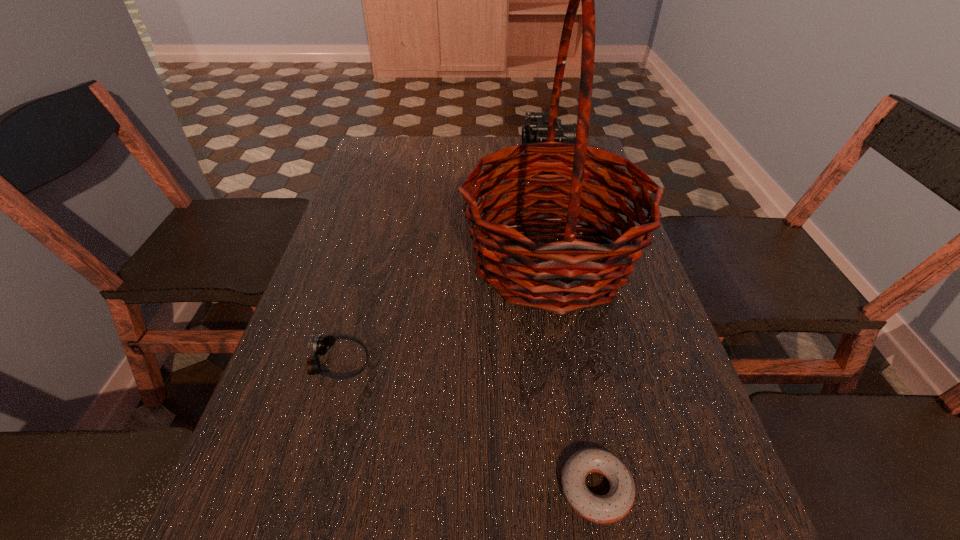
At what (x,y) coordinates should I click in order to perform the action: click on empty space that is in between the tallest object and the leftmost object. Please return your answer as a coordinate pair (x, y). This screenshot has height=540, width=960. Looking at the image, I should click on (444, 312).

Find the location of a particular element. The height and width of the screenshot is (540, 960). free spot between the basket and the nearest object is located at coordinates (573, 374).

Locate an element on the screen. The image size is (960, 540). blank region between the goggles and the basket is located at coordinates (444, 312).

Image resolution: width=960 pixels, height=540 pixels. Identify the location of vacant space that's between the basket and the leftmost object. (444, 312).

Find the location of a particular element. This screenshot has width=960, height=540. the third closest object relative to the second tallest object is located at coordinates (617, 503).

The width and height of the screenshot is (960, 540). Identify the location of object that ranks as the second closest to the binoculars. (321, 345).

Find the location of a particular element. This screenshot has height=540, width=960. free point that satisfies the following two spatial constraints: 1. on the back side of the doughnut; 2. on the handle side of the basket is located at coordinates (553, 260).

Where is `free spot that satisfies the following two spatial constraints: 1. through the lenses of the goggles; 2. on the right side of the doughnut`? free spot that satisfies the following two spatial constraints: 1. through the lenses of the goggles; 2. on the right side of the doughnut is located at coordinates (303, 489).

At what (x,y) coordinates should I click in order to perform the action: click on free space that satisfies the following two spatial constraints: 1. through the lenses of the third farthest object; 2. on the back side of the nearest object. Please return your answer as a coordinate pair (x, y). Image resolution: width=960 pixels, height=540 pixels. Looking at the image, I should click on (303, 489).

I want to click on vacant area in the image that satisfies the following two spatial constraints: 1. on the handle side of the basket; 2. on the right side of the nearest object, so click(x=591, y=489).